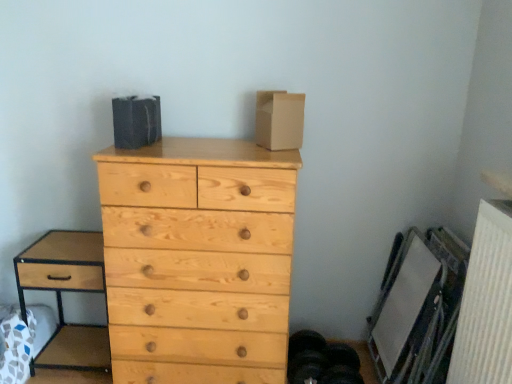
Where is `free location above brown wood nightstand at left (from a real-world perspective)`? The height and width of the screenshot is (384, 512). free location above brown wood nightstand at left (from a real-world perspective) is located at coordinates (70, 239).